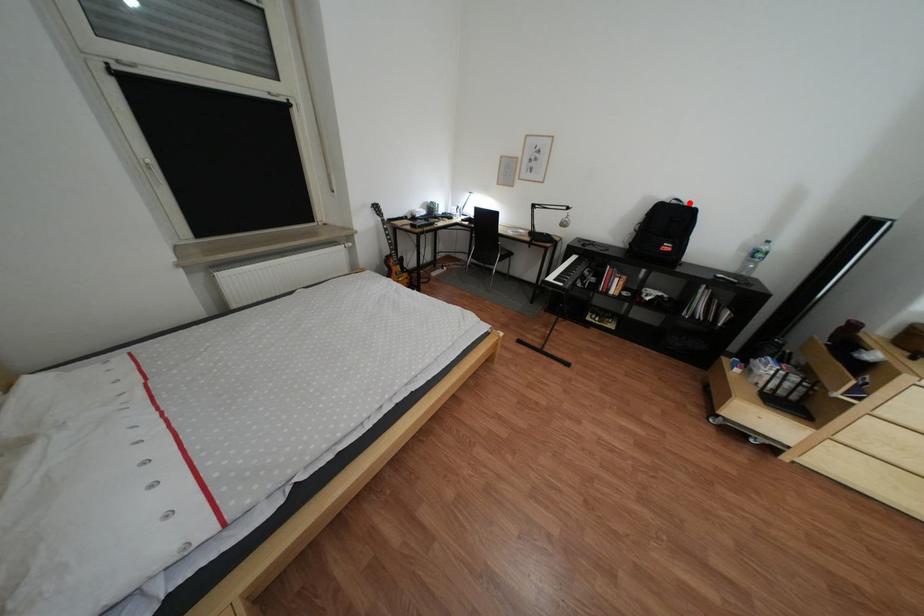
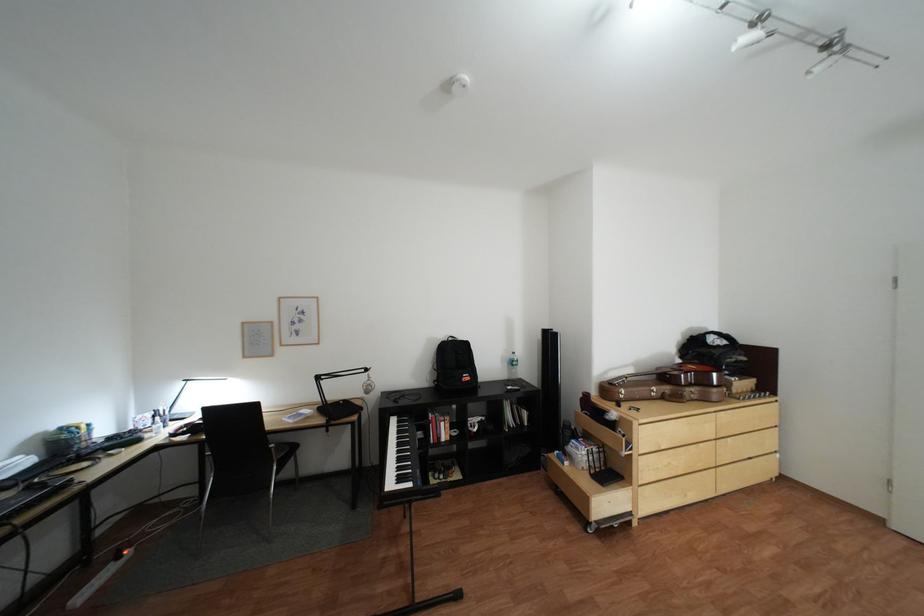
Where in the second image is the point corresponding to the highlighted location from the first image?

(466, 339)